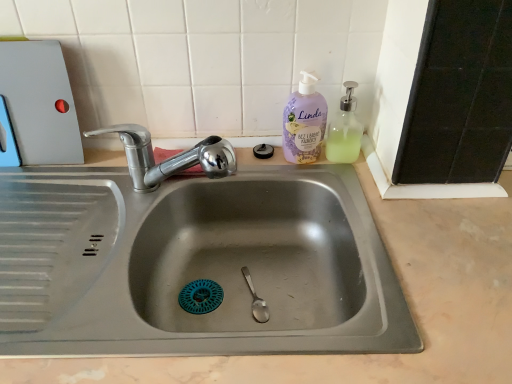
Question: Does clear plastic soap dispenser at upper right have a lesser width compared to lavender-colored pump bottle at upper right?

Choices:
 (A) yes
 (B) no

Answer: (B)

Question: Can you confirm if clear plastic soap dispenser at upper right is taller than lavender-colored pump bottle at upper right?

Choices:
 (A) yes
 (B) no

Answer: (B)

Question: Could you tell me if clear plastic soap dispenser at upper right is turned towards lavender-colored pump bottle at upper right?

Choices:
 (A) no
 (B) yes

Answer: (A)

Question: From a real-world perspective, is clear plastic soap dispenser at upper right beneath lavender-colored pump bottle at upper right?

Choices:
 (A) yes
 (B) no

Answer: (A)

Question: Is lavender-colored pump bottle at upper right at the back of clear plastic soap dispenser at upper right?

Choices:
 (A) yes
 (B) no

Answer: (B)

Question: From a real-world perspective, does clear plastic soap dispenser at upper right stand above lavender-colored pump bottle at upper right?

Choices:
 (A) yes
 (B) no

Answer: (B)

Question: Does matte plastic cutting board at upper left have a lesser width compared to chrome metallic faucet at upper left?

Choices:
 (A) yes
 (B) no

Answer: (A)

Question: Is matte plastic cutting board at upper left at the right side of chrome metallic faucet at upper left?

Choices:
 (A) no
 (B) yes

Answer: (A)

Question: Would you say matte plastic cutting board at upper left contains chrome metallic faucet at upper left?

Choices:
 (A) yes
 (B) no

Answer: (B)

Question: Does matte plastic cutting board at upper left turn towards chrome metallic faucet at upper left?

Choices:
 (A) no
 (B) yes

Answer: (A)

Question: Is the depth of matte plastic cutting board at upper left less than that of chrome metallic faucet at upper left?

Choices:
 (A) yes
 (B) no

Answer: (B)

Question: Does matte plastic cutting board at upper left come behind chrome metallic faucet at upper left?

Choices:
 (A) yes
 (B) no

Answer: (A)

Question: From a real-world perspective, is chrome metallic faucet at upper left located higher than lavender-colored pump bottle at upper right?

Choices:
 (A) yes
 (B) no

Answer: (B)